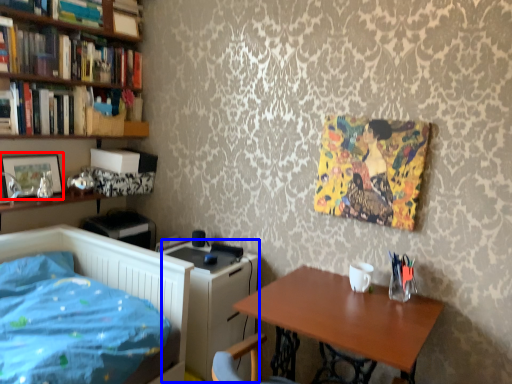
Question: Among these objects, which one is farthest to the camera, picture frame (highlighted by a red box) or computer desk (highlighted by a blue box)?

Choices:
 (A) picture frame
 (B) computer desk

Answer: (A)